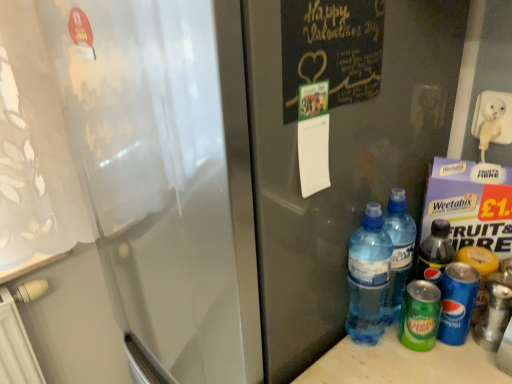
Question: Can you confirm if green matte can at lower right, the 2th bottle in the right-to-left sequence, is positioned to the right of translucent plastic water bottles at lower right, the third bottle in the right-to-left sequence?

Choices:
 (A) no
 (B) yes

Answer: (B)

Question: Does green matte can at lower right, the second bottle in the left-to-right sequence, lie behind translucent plastic water bottles at lower right, the first bottle when ordered from left to right?

Choices:
 (A) no
 (B) yes

Answer: (B)

Question: Does green matte can at lower right, the second bottle in the left-to-right sequence, have a smaller size compared to translucent plastic water bottles at lower right, the third bottle in the right-to-left sequence?

Choices:
 (A) no
 (B) yes

Answer: (B)

Question: From a real-world perspective, is green matte can at lower right, the second bottle in the left-to-right sequence, under translucent plastic water bottles at lower right, the first bottle when ordered from left to right?

Choices:
 (A) yes
 (B) no

Answer: (A)

Question: Can you confirm if green matte can at lower right, the second bottle in the left-to-right sequence, is shorter than translucent plastic water bottles at lower right, the third bottle in the right-to-left sequence?

Choices:
 (A) yes
 (B) no

Answer: (A)

Question: Is blue plastic bottle at lower right, placed as the 1th bottle when sorted from right to left, situated inside translucent plastic water bottles at lower right, the first bottle when ordered from left to right, or outside?

Choices:
 (A) outside
 (B) inside

Answer: (A)

Question: Is point (437, 334) positioned closer to the camera than point (373, 203)?

Choices:
 (A) farther
 (B) closer

Answer: (A)

Question: Considering the positions of blue plastic bottle at lower right, placed as the 1th bottle when sorted from right to left, and translucent plastic water bottles at lower right, the first bottle when ordered from left to right, in the image, is blue plastic bottle at lower right, placed as the 1th bottle when sorted from right to left, bigger or smaller than translucent plastic water bottles at lower right, the first bottle when ordered from left to right,?

Choices:
 (A) small
 (B) big

Answer: (A)

Question: Relative to translucent plastic water bottles at lower right, the third bottle in the right-to-left sequence, is blue plastic bottle at lower right, placed as the 1th bottle when sorted from right to left, in front or behind?

Choices:
 (A) front
 (B) behind

Answer: (B)

Question: From a real-world perspective, is green matte can at lower right, the second bottle in the left-to-right sequence, physically located above or below translucent plastic water bottles at lower right, the third bottle in the right-to-left sequence?

Choices:
 (A) above
 (B) below

Answer: (B)

Question: Does point (430, 347) appear closer or farther from the camera than point (369, 281)?

Choices:
 (A) farther
 (B) closer

Answer: (A)

Question: Is green matte can at lower right, the second bottle in the left-to-right sequence, inside or outside of translucent plastic water bottles at lower right, the third bottle in the right-to-left sequence?

Choices:
 (A) inside
 (B) outside

Answer: (B)

Question: Is green matte can at lower right, the second bottle in the left-to-right sequence, wider or thinner than translucent plastic water bottles at lower right, the first bottle when ordered from left to right?

Choices:
 (A) thin
 (B) wide

Answer: (A)

Question: Looking at their shapes, would you say translucent plastic water bottles at lower right, the third bottle in the right-to-left sequence, is wider or thinner than blue plastic bottle at lower right, which is counted as the 3th bottle, starting from the left?

Choices:
 (A) thin
 (B) wide

Answer: (B)

Question: From the image's perspective, relative to blue plastic bottle at lower right, placed as the 1th bottle when sorted from right to left, is translucent plastic water bottles at lower right, the first bottle when ordered from left to right, above or below?

Choices:
 (A) above
 (B) below

Answer: (A)